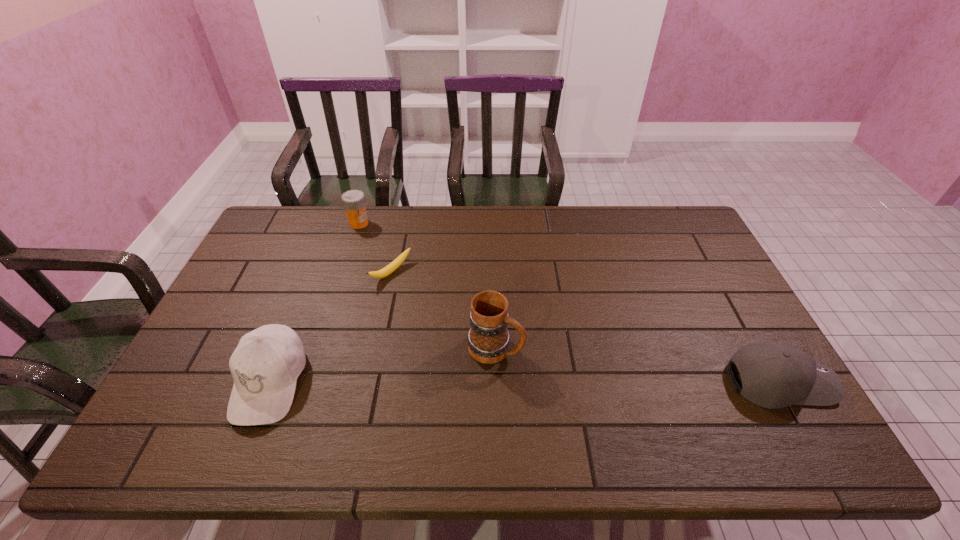
Find the location of a particular element. unoccupied area between the left baseball cap and the third object from right to left is located at coordinates (330, 327).

The width and height of the screenshot is (960, 540). I want to click on free space between the right baseball cap and the tallest object, so click(637, 364).

In order to click on vacant point located between the shortest object and the right baseball cap in this screenshot , I will do `click(586, 327)`.

Where is `free area in between the right baseball cap and the medicine`? The image size is (960, 540). free area in between the right baseball cap and the medicine is located at coordinates (569, 302).

The width and height of the screenshot is (960, 540). Find the location of `vacant area that lies between the medicine and the rightmost object`. vacant area that lies between the medicine and the rightmost object is located at coordinates (569, 302).

The height and width of the screenshot is (540, 960). Find the location of `free space between the rightmost object and the left baseball cap`. free space between the rightmost object and the left baseball cap is located at coordinates (524, 382).

Where is `unoccupied position between the left baseball cap and the tallest object`? unoccupied position between the left baseball cap and the tallest object is located at coordinates (382, 365).

You are a GUI agent. You are given a task and a screenshot of the screen. Output one action in this format:
    pyautogui.click(x=<x>, y=<y>)
    Task: Click on the empty space that is in between the right baseball cap and the mug
    The width and height of the screenshot is (960, 540).
    Given the screenshot: What is the action you would take?
    pyautogui.click(x=637, y=364)

Image resolution: width=960 pixels, height=540 pixels. What are the coordinates of `object that is the fourth closest one to the left baseball cap` in the screenshot? It's located at (774, 375).

The image size is (960, 540). Identify the location of object that is the closest to the farthest object. (394, 265).